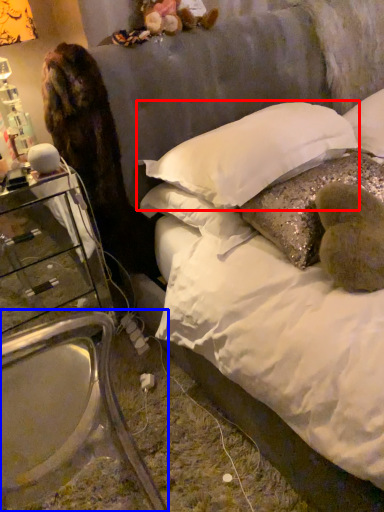
Question: Which of the following is the closest to the observer, pillow (highlighted by a red box) or armchair (highlighted by a blue box)?

Choices:
 (A) pillow
 (B) armchair

Answer: (B)